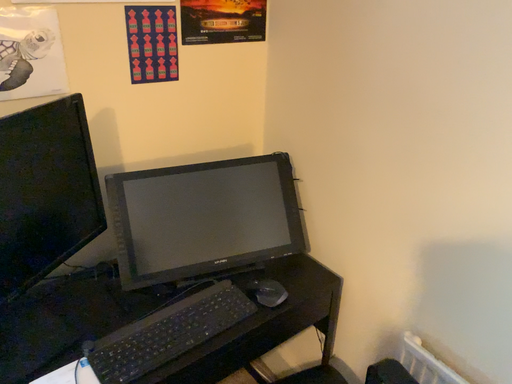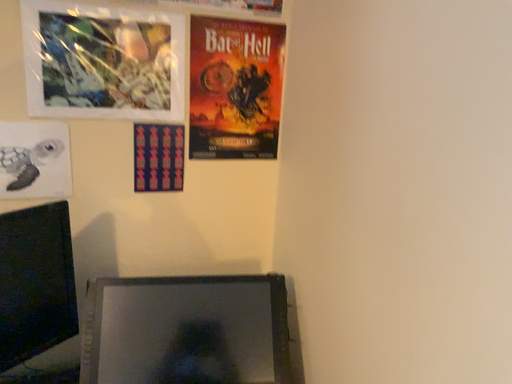
Question: Which way did the camera rotate in the video?

Choices:
 (A) rotated upward
 (B) rotated downward

Answer: (A)